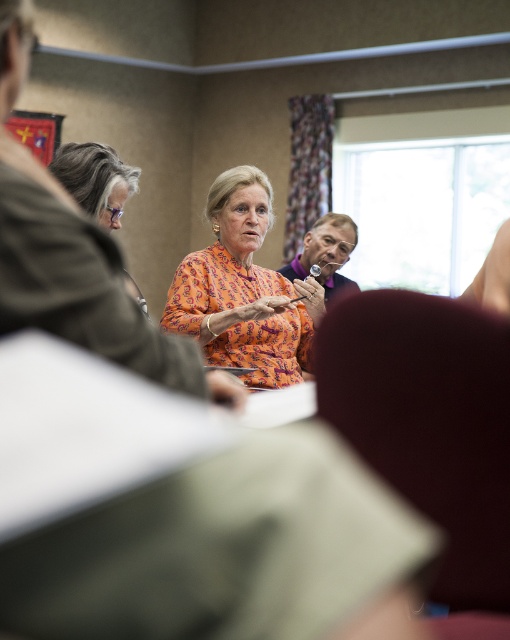
Is orange printed blouse at center taller than gray hair at left?

Indeed, orange printed blouse at center has a greater height compared to gray hair at left.

Does orange printed blouse at center lie behind gray hair at left?

Yes, orange printed blouse at center is further from the viewer.

Between point (176, 326) and point (80, 195), which one is positioned in front?

Point (80, 195)

In order to click on orange printed blouse at center in this screenshot , I will do `click(241, 289)`.